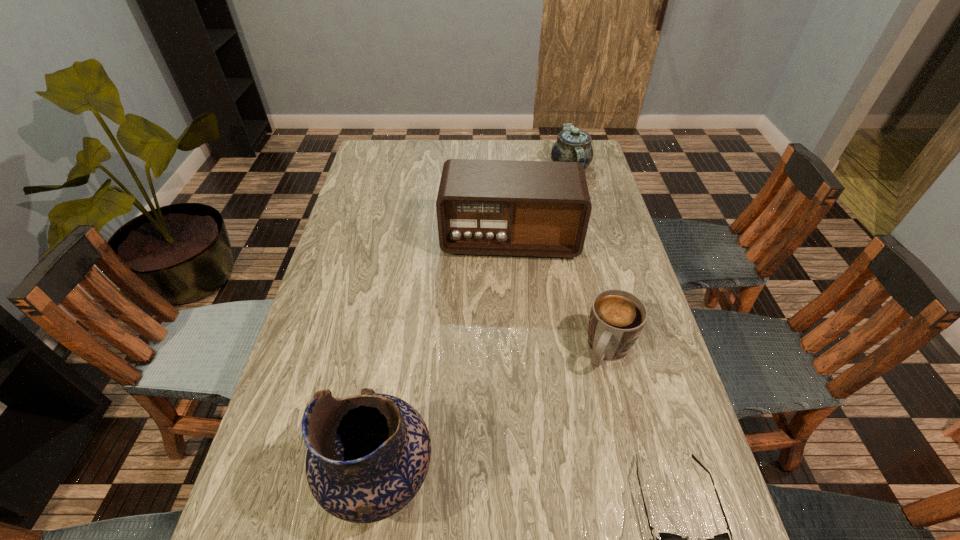
At what (x,y) coordinates should I click in order to perform the action: click on the third nearest object. Please return your answer as a coordinate pair (x, y). The image size is (960, 540). Looking at the image, I should click on (617, 317).

This screenshot has height=540, width=960. Identify the location of the second farthest object. tap(513, 208).

This screenshot has width=960, height=540. Find the location of `the second tallest object`. the second tallest object is located at coordinates pos(513,208).

Image resolution: width=960 pixels, height=540 pixels. Identify the location of the farthest object. (572, 145).

Locate an element on the screen. blank space located on the side of the mug with the handle is located at coordinates (580, 415).

You are a GUI agent. You are given a task and a screenshot of the screen. Output one action in this format:
    pyautogui.click(x=<x>, y=<y>)
    Task: Click on the free space located 0.290m on the side of the mug with the handle
    The width and height of the screenshot is (960, 540).
    Given the screenshot: What is the action you would take?
    pyautogui.click(x=546, y=482)

Image resolution: width=960 pixels, height=540 pixels. In order to click on free space located on the side of the mug with the handle in this screenshot , I will do `click(588, 397)`.

Where is `vacant space positioned on the front-facing side of the second tallest object`? The height and width of the screenshot is (540, 960). vacant space positioned on the front-facing side of the second tallest object is located at coordinates (508, 375).

The height and width of the screenshot is (540, 960). What are the coordinates of `vacant space located 0.160m on the front-facing side of the second tallest object` in the screenshot? It's located at (508, 302).

Identify the location of free spot located 0.060m on the front-facing side of the second tallest object. This screenshot has height=540, width=960. click(x=508, y=276).